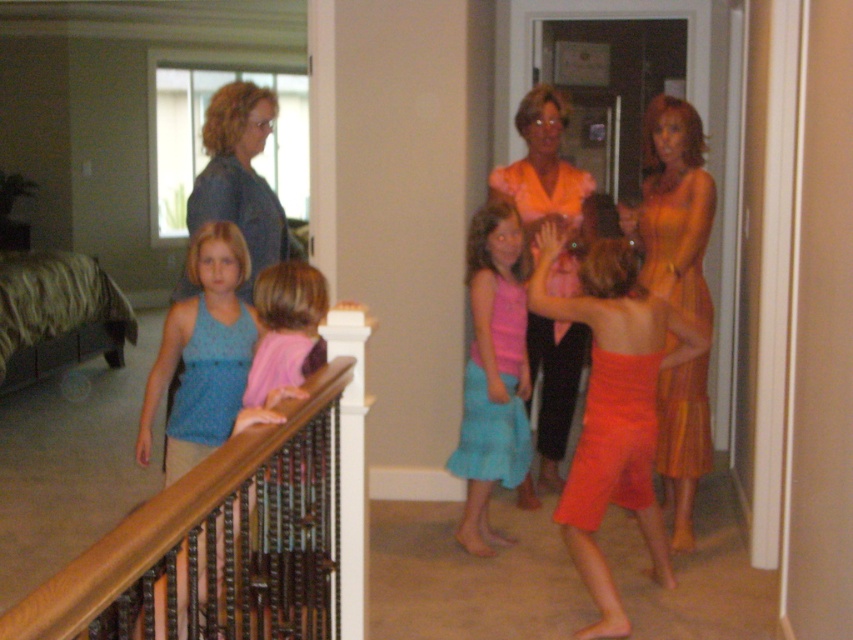
You are standing at the base of the staircase and want to move towards the two points marked in the image. Which point, point (345, 522) or point (579, 209), would you reach first?

Point (345, 522) is closer to the viewer than point (579, 209), so you would reach point (345, 522) first.

You are an interior designer assessing the space for a new piece of furniture. You notice the wooden at upper left and the orange satin blouse at center. Which object would require a larger storage space if you were to store them?

The orange satin blouse at center requires more storage space because the wooden at upper left is smaller in size compared to it.

In the scene shown: You are standing at the bottom of the staircase in this image. There is a wooden area at the upper left. Can you see the point marked as coordinates (x=71, y=464) from your current position?

Yes, the point marked as coordinates (x=71, y=464) corresponds to the wooden area at the upper left, which is visible from the bottom of the staircase.